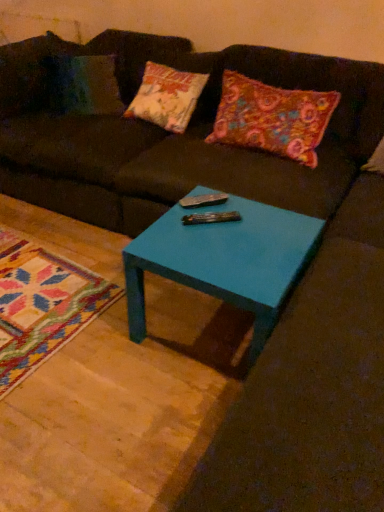
Question: Is metallic silver remote at center in front of or behind teal glossy table at center in the image?

Choices:
 (A) behind
 (B) front

Answer: (A)

Question: Considering the positions of metallic silver remote at center and teal glossy table at center in the image, is metallic silver remote at center wider or thinner than teal glossy table at center?

Choices:
 (A) thin
 (B) wide

Answer: (A)

Question: Which object is the closest to the metallic silver remote at center?

Choices:
 (A) teal glossy table at center
 (B) matte brown couch at center
 (C) multicolored felt pillow at upper right

Answer: (A)

Question: Which object is positioned farthest from the metallic silver remote at center?

Choices:
 (A) multicolored felt pillow at upper right
 (B) matte brown couch at center
 (C) teal glossy table at center

Answer: (B)